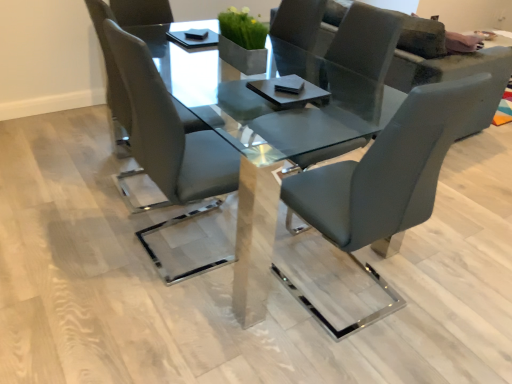
Locate an element on the screen. free space in front of matte gray chair at center, arranged as the third chair when viewed from the left is located at coordinates pyautogui.click(x=336, y=352).